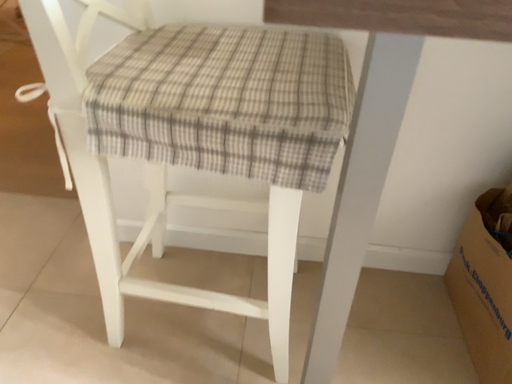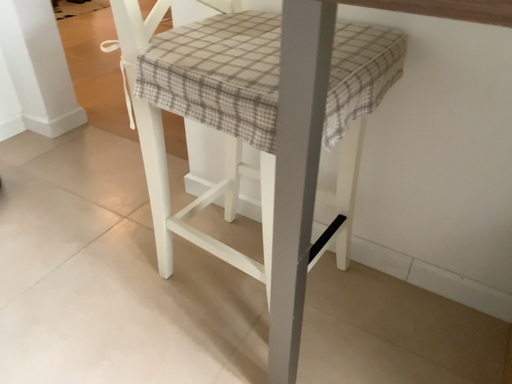
Question: How did the camera likely rotate when shooting the video?

Choices:
 (A) rotated left
 (B) rotated right

Answer: (A)